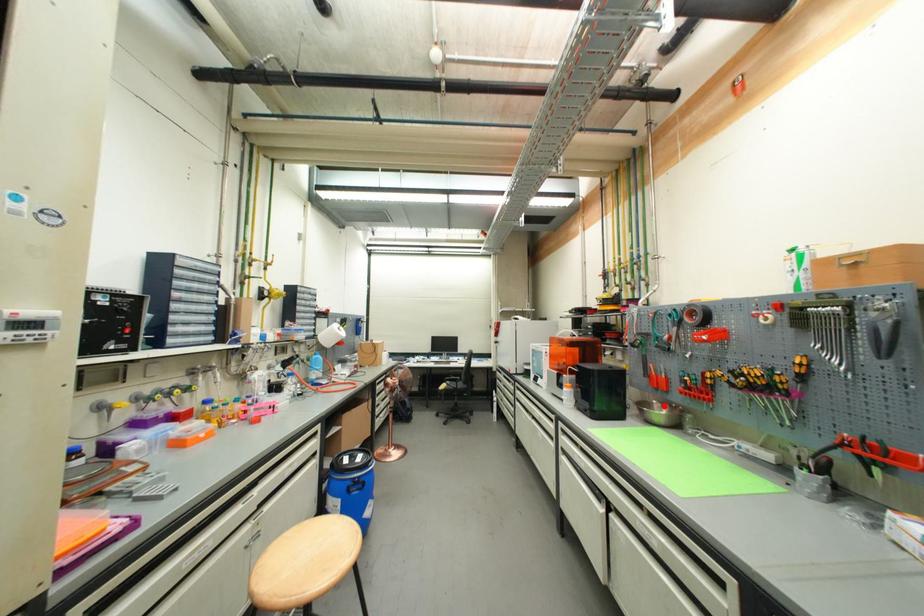
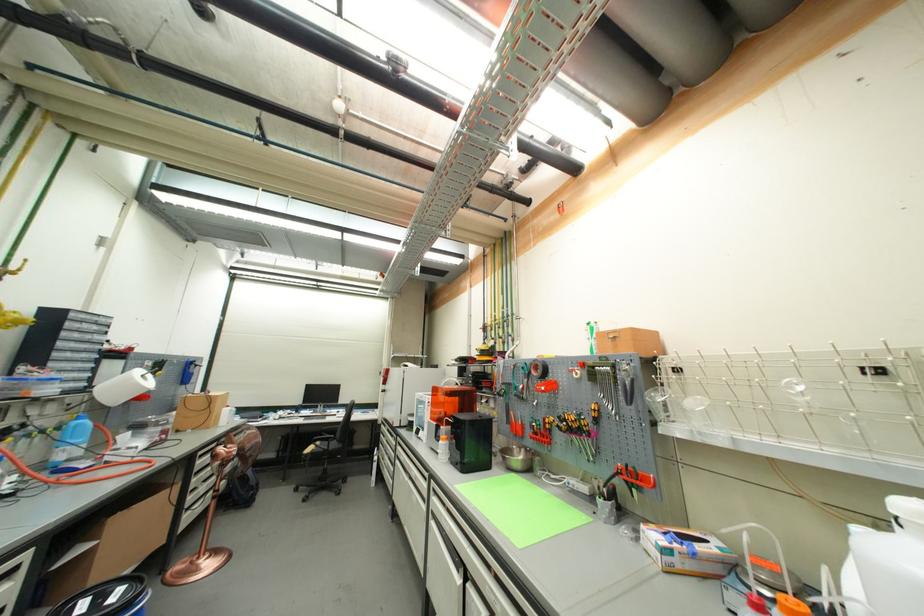
Find the pixel in the second image that matches the highlighted location in the first image.

(524, 451)